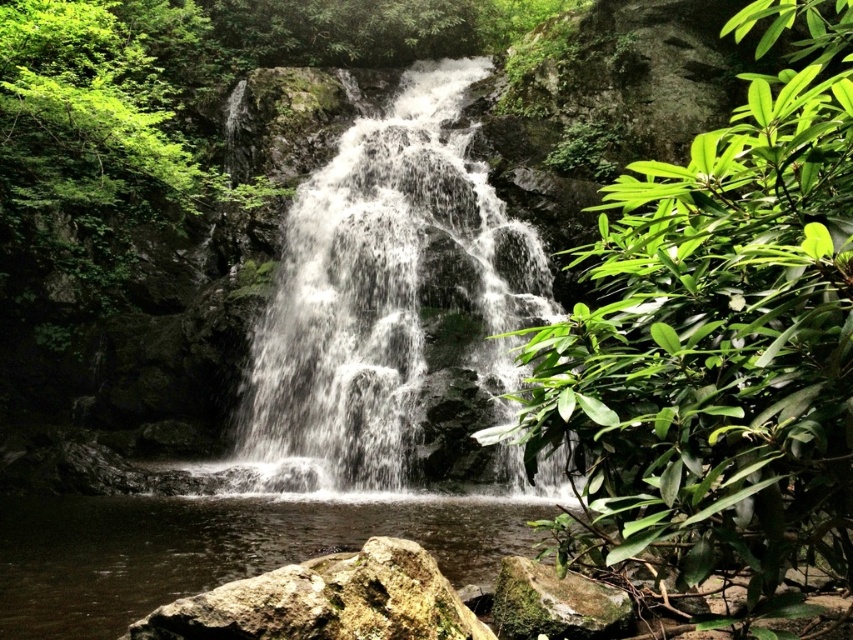
Question: Which object is positioned farthest from the green mossy rock at center?

Choices:
 (A) brown rough rock at lower center
 (B) clear water at center

Answer: (B)

Question: Which point is farther to the camera?

Choices:
 (A) (102, 589)
 (B) (547, 614)
 (C) (457, 625)

Answer: (A)

Question: Is white frothy water at center to the right of clear water at center from the viewer's perspective?

Choices:
 (A) yes
 (B) no

Answer: (A)

Question: Is white frothy water at center smaller than brown rough rock at lower center?

Choices:
 (A) no
 (B) yes

Answer: (A)

Question: Does white frothy water at center lie behind green mossy rock at center?

Choices:
 (A) no
 (B) yes

Answer: (B)

Question: Which point appears farthest from the camera in this image?

Choices:
 (A) (132, 547)
 (B) (196, 634)
 (C) (721, 493)

Answer: (A)